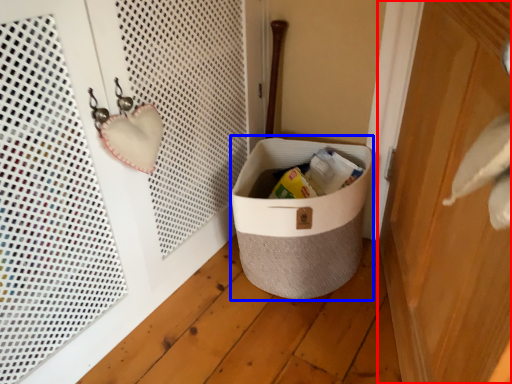
Question: Which object appears closest to the camera in this image, door (highlighted by a red box) or storage box (highlighted by a blue box)?

Choices:
 (A) door
 (B) storage box

Answer: (A)